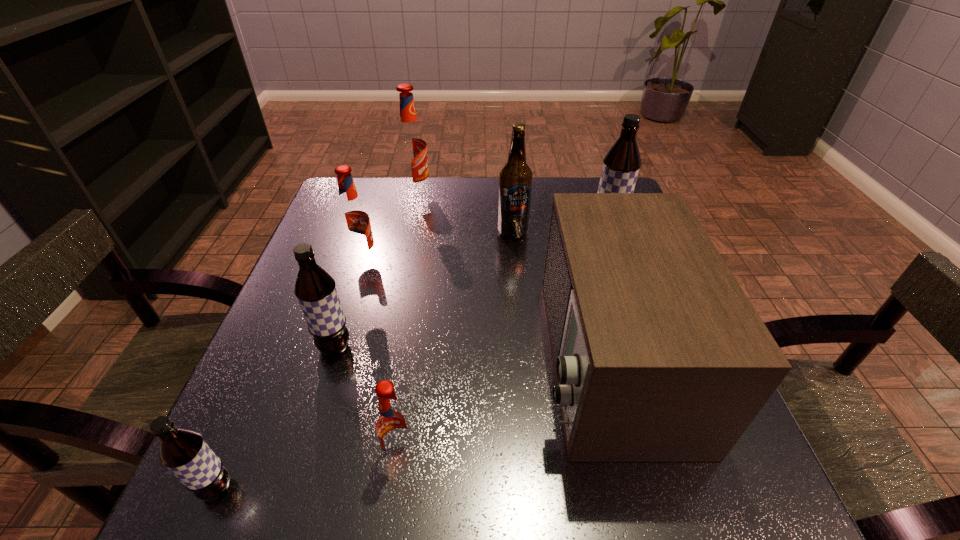
Identify which brown root beer is located as the nearest to the smallest red root beer. Please provide its 2D coordinates. Your answer should be formatted as a tuple, i.e. [(x, y)], where the tuple contains the x and y coordinates of a point satisfying the conditions above.

[(315, 289)]

Where is `vacant space that satisfies the following two spatial constraints: 1. on the back side of the second farthest red root beer; 2. on the right side of the leftmost object`? The image size is (960, 540). vacant space that satisfies the following two spatial constraints: 1. on the back side of the second farthest red root beer; 2. on the right side of the leftmost object is located at coordinates (315, 260).

I want to click on vacant space that satisfies the following two spatial constraints: 1. on the label of the beer bottle; 2. on the right side of the rightmost brown root beer, so click(513, 233).